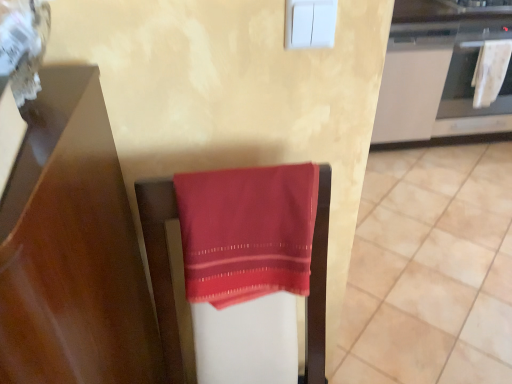
Question: Would you say white glossy cabinet at upper right is inside or outside smooth red towel at center?

Choices:
 (A) outside
 (B) inside

Answer: (A)

Question: From a real-world perspective, is white glossy cabinet at upper right above or below smooth red towel at center?

Choices:
 (A) above
 (B) below

Answer: (A)

Question: Estimate the real-world distances between objects in this image. Which object is closer to the smooth red towel at center?

Choices:
 (A) white glossy cabinet at upper right
 (B) satin red cloth at center
 (C) white fabric oven at upper right
 (D) white textured towel at right

Answer: (A)

Question: Which is nearer to the white fabric oven at upper right?

Choices:
 (A) satin red cloth at center
 (B) white textured towel at right
 (C) white glossy cabinet at upper right
 (D) smooth red towel at center

Answer: (B)